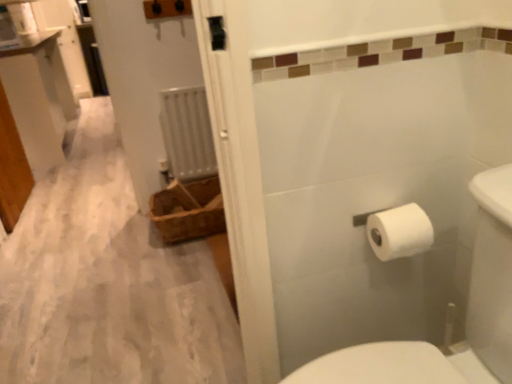
Question: Considering the positions of white metallic radiator at center and white matte toilet paper at right in the image, is white metallic radiator at center taller or shorter than white matte toilet paper at right?

Choices:
 (A) short
 (B) tall

Answer: (B)

Question: Considering the positions of point (168, 135) and point (390, 241), is point (168, 135) closer or farther from the camera than point (390, 241)?

Choices:
 (A) farther
 (B) closer

Answer: (A)

Question: Which of these objects is positioned closest to the white metallic radiator at center?

Choices:
 (A) white matte toilet paper at right
 (B) white glossy vanity at upper left
 (C) brown woven basket at left
 (D) white paper towel at right

Answer: (C)

Question: Which object is positioned farthest from the white metallic radiator at center?

Choices:
 (A) white matte toilet paper at right
 (B) white glossy vanity at upper left
 (C) white paper towel at right
 (D) brown woven basket at left

Answer: (A)